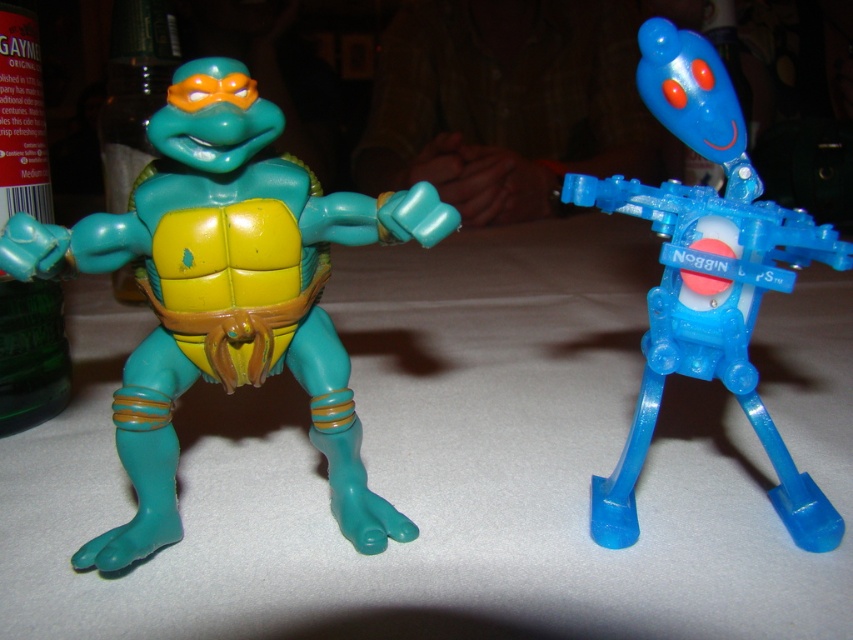
Is translucent blue plastic robot at right taller than green glass bottle at left?

No.

Is point (614, 528) positioned in front of point (6, 300)?

That is True.

Between point (740, 108) and point (3, 410), which one is positioned behind?

The point (3, 410) is more distant.

This screenshot has width=853, height=640. I want to click on translucent blue plastic robot at right, so click(706, 276).

Is matte plastic turtle at left to the right of green matte bottle at left from the viewer's perspective?

Correct, you'll find matte plastic turtle at left to the right of green matte bottle at left.

Can you confirm if matte plastic turtle at left is wider than green matte bottle at left?

Correct, the width of matte plastic turtle at left exceeds that of green matte bottle at left.

Where is `matte plastic turtle at left`? The image size is (853, 640). matte plastic turtle at left is located at coordinates (228, 292).

Locate an element on the screen. The width and height of the screenshot is (853, 640). matte plastic turtle at left is located at coordinates (228, 292).

Is matte plastic turtle at left shorter than green glass bottle at left?

Yes, matte plastic turtle at left is shorter than green glass bottle at left.

Describe the element at coordinates (228, 292) in the screenshot. I see `matte plastic turtle at left` at that location.

Locate an element on the screen. The image size is (853, 640). matte plastic turtle at left is located at coordinates (228, 292).

At what (x,y) coordinates should I click in order to perform the action: click on matte plastic turtle at left. Please return your answer as a coordinate pair (x, y). Looking at the image, I should click on (228, 292).